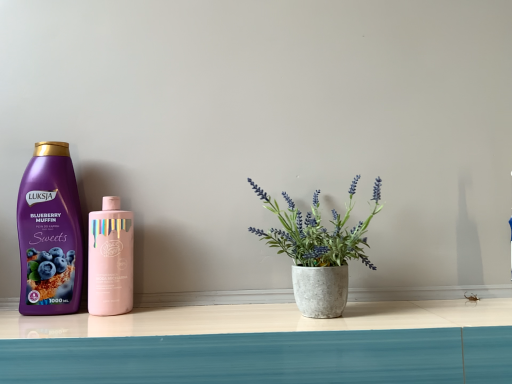
This screenshot has width=512, height=384. Identify the location of purple matte bottle at left, the second bottle viewed from the right. [x=50, y=233].

What do you see at coordinates (50, 233) in the screenshot? I see `purple matte bottle at left, positioned as the 1th bottle in left-to-right order` at bounding box center [50, 233].

Find the location of a particular element. The image size is (512, 384). pink glossy bottle at center, the first bottle from the right is located at coordinates (110, 259).

In order to face pink glossy bottle at center, the first bottle from the right, should I rotate leftwards or rightwards?

To align with it, rotate left about 18.872°.

This screenshot has height=384, width=512. What do you see at coordinates (110, 259) in the screenshot? I see `pink glossy bottle at center, the first bottle from the right` at bounding box center [110, 259].

What is the approximate height of pink glossy bottle at center, the first bottle from the right?

The height of pink glossy bottle at center, the first bottle from the right, is 7.61 inches.

Image resolution: width=512 pixels, height=384 pixels. In order to click on purple matte bottle at left, positioned as the 1th bottle in left-to-right order in this screenshot , I will do `click(50, 233)`.

Between purple matte bottle at left, the second bottle viewed from the right, and pink glossy bottle at center, the first bottle from the right, which one appears on the right side from the viewer's perspective?

pink glossy bottle at center, the first bottle from the right, is more to the right.

In the image, is purple matte bottle at left, the second bottle viewed from the right, positioned in front of or behind pink glossy bottle at center, arranged as the 2th bottle when viewed from the left?

purple matte bottle at left, the second bottle viewed from the right, is positioned farther from the viewer than pink glossy bottle at center, arranged as the 2th bottle when viewed from the left.

Considering the positions of points (31, 238) and (118, 282), is point (31, 238) closer to camera compared to point (118, 282)?

No.

From the image's perspective, relative to pink glossy bottle at center, arranged as the 2th bottle when viewed from the left, is purple matte bottle at left, the second bottle viewed from the right, above or below?

purple matte bottle at left, the second bottle viewed from the right, is situated higher than pink glossy bottle at center, arranged as the 2th bottle when viewed from the left, in the image.

From a real-world perspective, is purple matte bottle at left, the second bottle viewed from the right, physically below pink glossy bottle at center, the first bottle from the right?

No, from a real-world perspective, purple matte bottle at left, the second bottle viewed from the right, is not beneath pink glossy bottle at center, the first bottle from the right.

Between purple matte bottle at left, the second bottle viewed from the right, and pink glossy bottle at center, arranged as the 2th bottle when viewed from the left, which one has larger width?

pink glossy bottle at center, arranged as the 2th bottle when viewed from the left, is wider.

From their relative heights in the image, would you say purple matte bottle at left, positioned as the 1th bottle in left-to-right order, is taller or shorter than pink glossy bottle at center, the first bottle from the right?

Clearly, purple matte bottle at left, positioned as the 1th bottle in left-to-right order, is taller compared to pink glossy bottle at center, the first bottle from the right.

Does purple matte bottle at left, positioned as the 1th bottle in left-to-right order, have a smaller size compared to pink glossy bottle at center, arranged as the 2th bottle when viewed from the left?

No.

Is purple matte bottle at left, positioned as the 1th bottle in left-to-right order, completely or partially outside of pink glossy bottle at center, arranged as the 2th bottle when viewed from the left?

That's correct, purple matte bottle at left, positioned as the 1th bottle in left-to-right order, is outside of pink glossy bottle at center, arranged as the 2th bottle when viewed from the left.

Based on the photo, is purple matte bottle at left, positioned as the 1th bottle in left-to-right order, directly adjacent to pink glossy bottle at center, arranged as the 2th bottle when viewed from the left?

Yes.

Is purple matte bottle at left, positioned as the 1th bottle in left-to-right order, facing away from pink glossy bottle at center, the first bottle from the right?

purple matte bottle at left, positioned as the 1th bottle in left-to-right order, is not turned away from pink glossy bottle at center, the first bottle from the right.

This screenshot has width=512, height=384. What are the coordinates of `bottle in front of the purple matte bottle at left, positioned as the 1th bottle in left-to-right order` in the screenshot? It's located at (110, 259).

Is pink glossy bottle at center, arranged as the 2th bottle when viewed from the left, to the right of purple matte bottle at left, the second bottle viewed from the right, from the viewer's perspective?

Yes, pink glossy bottle at center, arranged as the 2th bottle when viewed from the left, is to the right of purple matte bottle at left, the second bottle viewed from the right.

In the image, is pink glossy bottle at center, arranged as the 2th bottle when viewed from the left, positioned in front of or behind purple matte bottle at left, the second bottle viewed from the right?

pink glossy bottle at center, arranged as the 2th bottle when viewed from the left, is in front of purple matte bottle at left, the second bottle viewed from the right.

Is point (116, 268) positioned in front of point (30, 250)?

Yes, point (116, 268) is closer to viewer.

From the image's perspective, is pink glossy bottle at center, the first bottle from the right, above or below purple matte bottle at left, the second bottle viewed from the right?

Based on their image positions, pink glossy bottle at center, the first bottle from the right, is located beneath purple matte bottle at left, the second bottle viewed from the right.

From a real-world perspective, is pink glossy bottle at center, the first bottle from the right, on purple matte bottle at left, positioned as the 1th bottle in left-to-right order?

No, from a real-world perspective, pink glossy bottle at center, the first bottle from the right, is not over purple matte bottle at left, positioned as the 1th bottle in left-to-right order

Looking at their sizes, would you say pink glossy bottle at center, arranged as the 2th bottle when viewed from the left, is wider or thinner than purple matte bottle at left, the second bottle viewed from the right?

Clearly, pink glossy bottle at center, arranged as the 2th bottle when viewed from the left, has more width compared to purple matte bottle at left, the second bottle viewed from the right.

Who is taller, pink glossy bottle at center, arranged as the 2th bottle when viewed from the left, or purple matte bottle at left, positioned as the 1th bottle in left-to-right order?

With more height is purple matte bottle at left, positioned as the 1th bottle in left-to-right order.

Who is smaller, pink glossy bottle at center, the first bottle from the right, or purple matte bottle at left, positioned as the 1th bottle in left-to-right order?

Smaller between the two is pink glossy bottle at center, the first bottle from the right.

Is purple matte bottle at left, positioned as the 1th bottle in left-to-right order, a part of pink glossy bottle at center, the first bottle from the right?

Definitely not — purple matte bottle at left, positioned as the 1th bottle in left-to-right order, is not inside pink glossy bottle at center, the first bottle from the right.

Are pink glossy bottle at center, arranged as the 2th bottle when viewed from the left, and purple matte bottle at left, positioned as the 1th bottle in left-to-right order, located far from each other?

They are positioned close to each other.

Is pink glossy bottle at center, arranged as the 2th bottle when viewed from the left, oriented towards purple matte bottle at left, positioned as the 1th bottle in left-to-right order?

No.

How many degrees apart are the facing directions of pink glossy bottle at center, arranged as the 2th bottle when viewed from the left, and purple matte bottle at left, positioned as the 1th bottle in left-to-right order?

0.00142 degrees separate the facing orientations of pink glossy bottle at center, arranged as the 2th bottle when viewed from the left, and purple matte bottle at left, positioned as the 1th bottle in left-to-right order.

This screenshot has width=512, height=384. Identify the location of bottle beneath the purple matte bottle at left, the second bottle viewed from the right (from a real-world perspective). (110, 259).

Where is `bottle directly beneath the purple matte bottle at left, positioned as the 1th bottle in left-to-right order (from a real-world perspective)`? This screenshot has height=384, width=512. bottle directly beneath the purple matte bottle at left, positioned as the 1th bottle in left-to-right order (from a real-world perspective) is located at coordinates (110, 259).

Locate an element on the screen. Image resolution: width=512 pixels, height=384 pixels. bottle above the pink glossy bottle at center, arranged as the 2th bottle when viewed from the left (from a real-world perspective) is located at coordinates (50, 233).